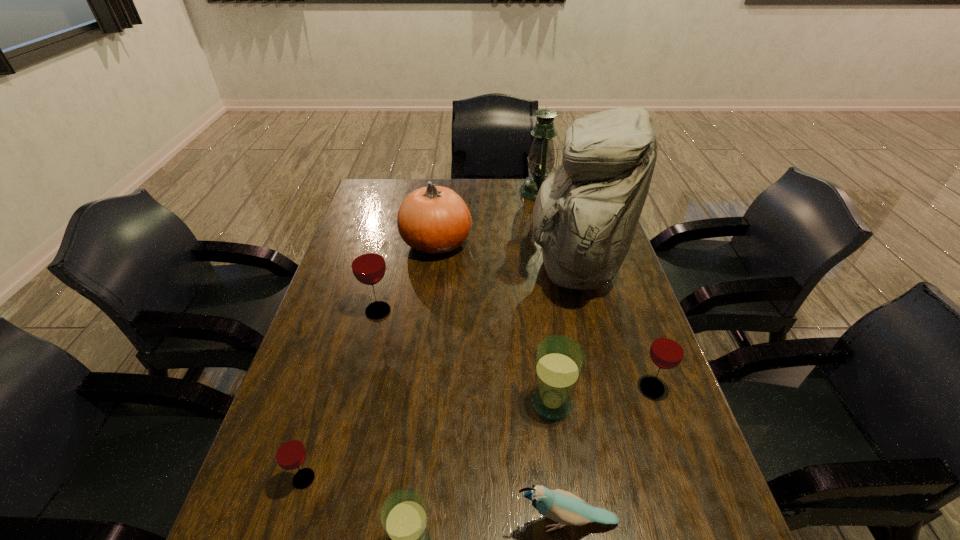
The height and width of the screenshot is (540, 960). In the image, there is a desktop. In order to click on vacant space at the far edge in this screenshot , I will do `click(522, 198)`.

At what (x,y) coordinates should I click in order to perform the action: click on vacant region at the left edge. Please return your answer as a coordinate pair (x, y). This screenshot has width=960, height=540. Looking at the image, I should click on (348, 335).

In the image, there is a desktop. At what (x,y) coordinates should I click in order to perform the action: click on free space at the right edge. Please return your answer as a coordinate pair (x, y). Looking at the image, I should click on (636, 509).

In the image, there is a desktop. Where is `free region at the far left corner`? free region at the far left corner is located at coordinates (402, 195).

At what (x,y) coordinates should I click in order to perform the action: click on free space between the orange pumpkin and the biggest red glass. Please return your answer as a coordinate pair (x, y). Looking at the image, I should click on (407, 277).

The width and height of the screenshot is (960, 540). In order to click on free space that is in between the tallest glass and the nearest red glass in this screenshot , I will do (341, 395).

This screenshot has width=960, height=540. Identify the location of unoccupied area between the backpack and the second nearest red glass. (612, 328).

The image size is (960, 540). I want to click on free space between the pumpkin and the tallest object, so click(x=505, y=255).

Locate an element on the screen. This screenshot has height=540, width=960. free space between the farther blue glass and the second biggest red glass is located at coordinates (602, 395).

The width and height of the screenshot is (960, 540). In order to click on vacant area that lies between the rightmost red glass and the backpack in this screenshot , I will do `click(612, 328)`.